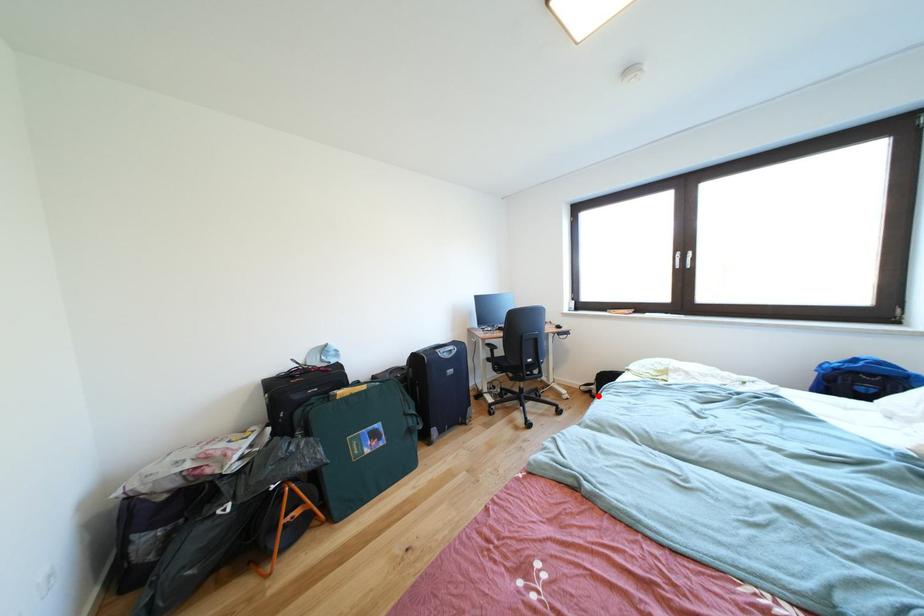
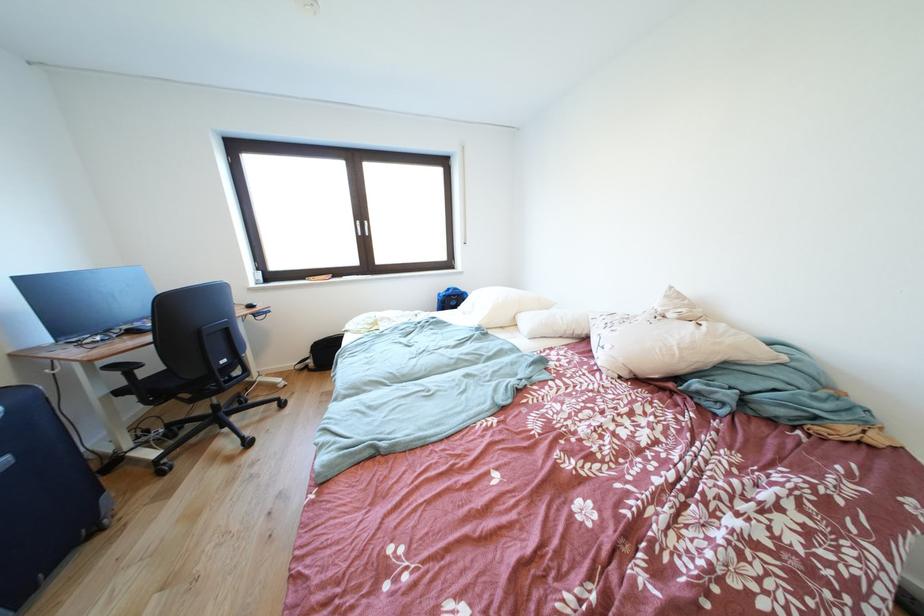
Find the pixel in the second image that matches the highlighted location in the first image.

(315, 371)